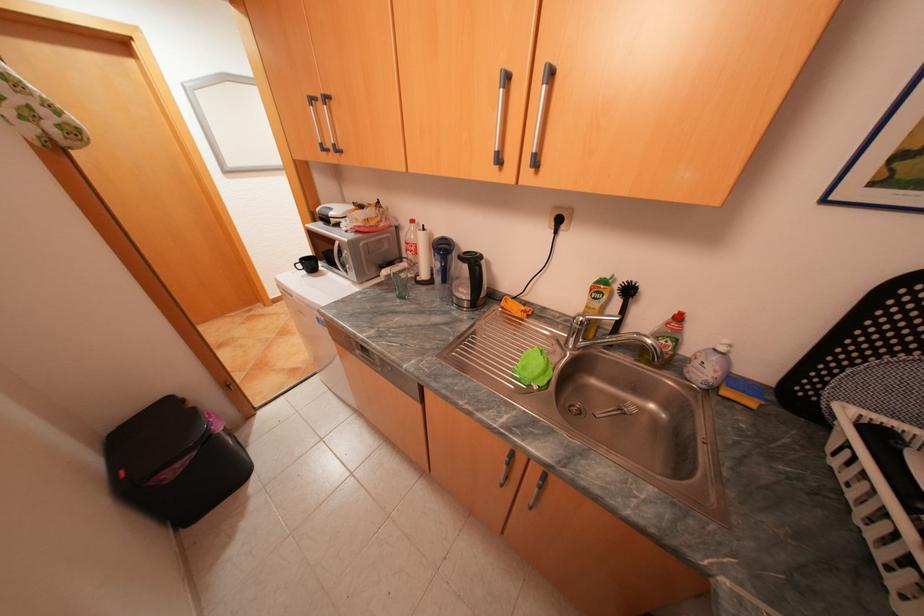
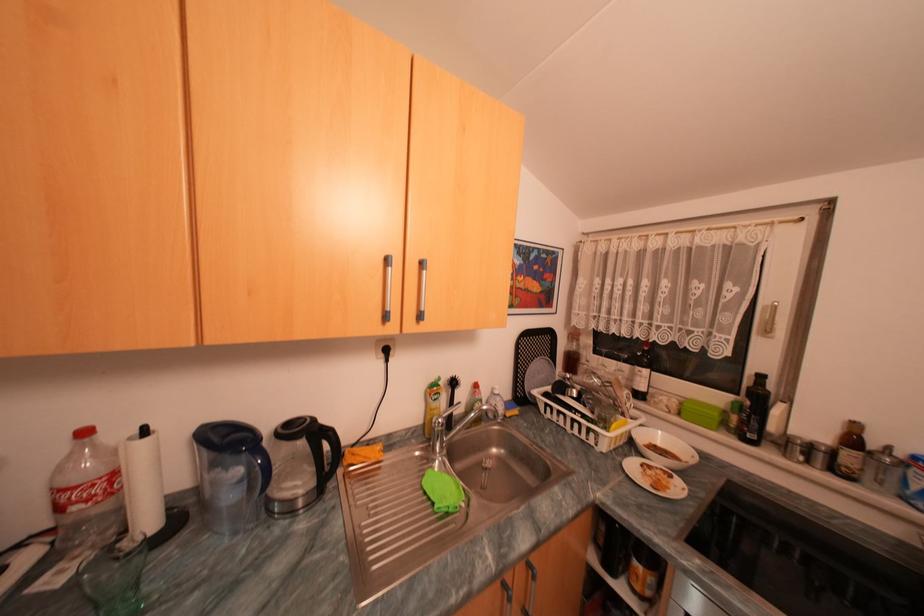
Locate, in the second image, the point that corresponds to (x=433, y=228) in the first image.

(155, 432)